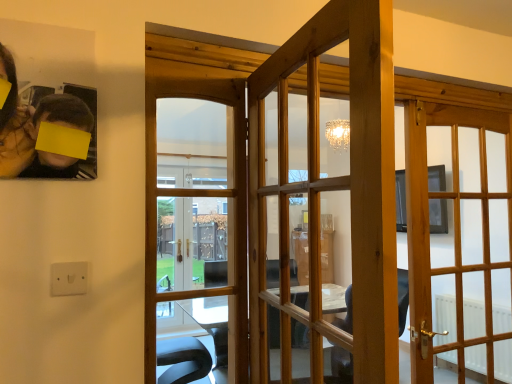
Question: Is light wood door at right, placed as the 1th door when sorted from back to front, thinner than wooden glass door at center, which is the 1th door in front-to-back order?

Choices:
 (A) yes
 (B) no

Answer: (B)

Question: Does light wood door at right, acting as the 1th door starting from the right, have a greater width compared to wooden glass door at center, which appears as the third door when viewed from the back?

Choices:
 (A) yes
 (B) no

Answer: (A)

Question: From the image's perspective, is light wood door at right, placed as the 1th door when sorted from back to front, under wooden glass door at center, acting as the second door starting from the right?

Choices:
 (A) yes
 (B) no

Answer: (A)

Question: Can you confirm if light wood door at right, which is the third door in left-to-right order, is taller than wooden glass door at center, which is the 1th door in front-to-back order?

Choices:
 (A) no
 (B) yes

Answer: (B)

Question: Could you tell me if light wood door at right, acting as the 1th door starting from the right, is turned towards wooden glass door at center, which appears as the third door when viewed from the back?

Choices:
 (A) yes
 (B) no

Answer: (B)

Question: Is light wood door at right, which ranks as the 3th door in front-to-back order, shorter than wooden glass door at center, which is the 2th door in left-to-right order?

Choices:
 (A) no
 (B) yes

Answer: (A)

Question: Is wooden glass door at center, arranged as the 1th door when viewed from the left, outside of white plastic electric outlet at lower left?

Choices:
 (A) no
 (B) yes

Answer: (B)

Question: From the image's perspective, is wooden glass door at center, marked as the 2th door in a back-to-front arrangement, on white plastic electric outlet at lower left?

Choices:
 (A) yes
 (B) no

Answer: (A)

Question: Does wooden glass door at center, the 2th door from the front, appear on the left side of white plastic electric outlet at lower left?

Choices:
 (A) no
 (B) yes

Answer: (A)

Question: Is wooden glass door at center, arranged as the 1th door when viewed from the left, in front of white plastic electric outlet at lower left?

Choices:
 (A) yes
 (B) no

Answer: (B)

Question: Is wooden glass door at center, the 2th door from the front, facing away from white plastic electric outlet at lower left?

Choices:
 (A) no
 (B) yes

Answer: (A)

Question: Can you confirm if wooden glass door at center, which appears as the 3th door when viewed from the right, is wider than white plastic electric outlet at lower left?

Choices:
 (A) yes
 (B) no

Answer: (A)

Question: From the image's perspective, is light wood door at right, acting as the 1th door starting from the right, located beneath green matte plant at upper left?

Choices:
 (A) no
 (B) yes

Answer: (B)